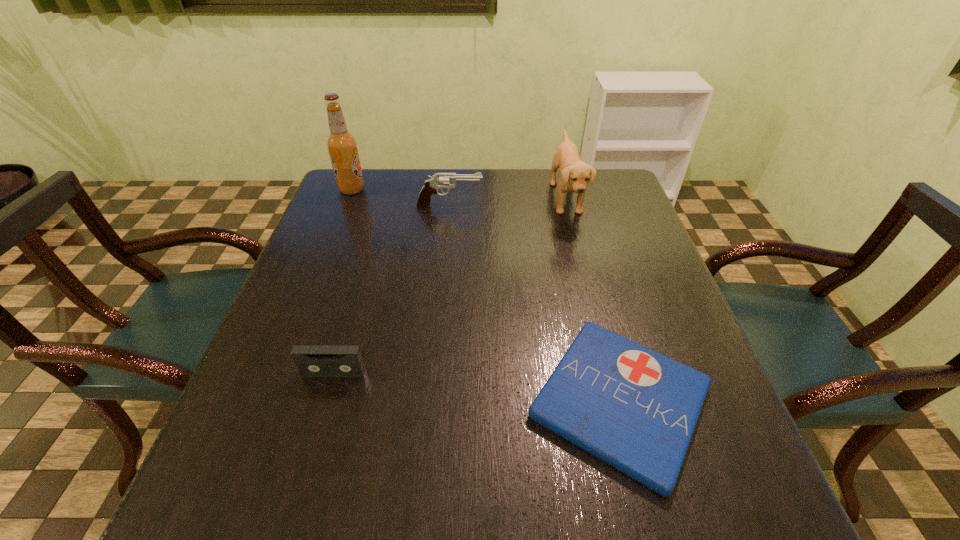
This screenshot has height=540, width=960. I want to click on free space located on the left side of the fourth shortest object, so click(510, 198).

The width and height of the screenshot is (960, 540). Find the location of `blank space located on the left side of the fourth shortest object`. blank space located on the left side of the fourth shortest object is located at coordinates (444, 198).

This screenshot has height=540, width=960. Identify the location of vacant space located at the muzzle of the third shortest object. (549, 206).

Where is `free region located 0.180m on the front-facing side of the fourth tallest object`? The width and height of the screenshot is (960, 540). free region located 0.180m on the front-facing side of the fourth tallest object is located at coordinates (305, 472).

Identify the location of vacant area located on the back of the first-aid kit. (573, 222).

At what (x,y) coordinates should I click in order to perform the action: click on beer bottle that is at the far edge. Please return your answer as a coordinate pair (x, y). This screenshot has width=960, height=540. Looking at the image, I should click on (342, 146).

The height and width of the screenshot is (540, 960). What are the coordinates of `puppy that is at the far edge` in the screenshot? It's located at (574, 174).

At what (x,y) coordinates should I click in order to perform the action: click on gun positioned at the far edge. Please return your answer as a coordinate pair (x, y). The height and width of the screenshot is (540, 960). Looking at the image, I should click on (439, 180).

At what (x,y) coordinates should I click in order to perform the action: click on object that is positioned at the near edge. Please return your answer as a coordinate pair (x, y). This screenshot has width=960, height=540. Looking at the image, I should click on (636, 409).

The image size is (960, 540). I want to click on beer bottle that is at the left edge, so click(342, 146).